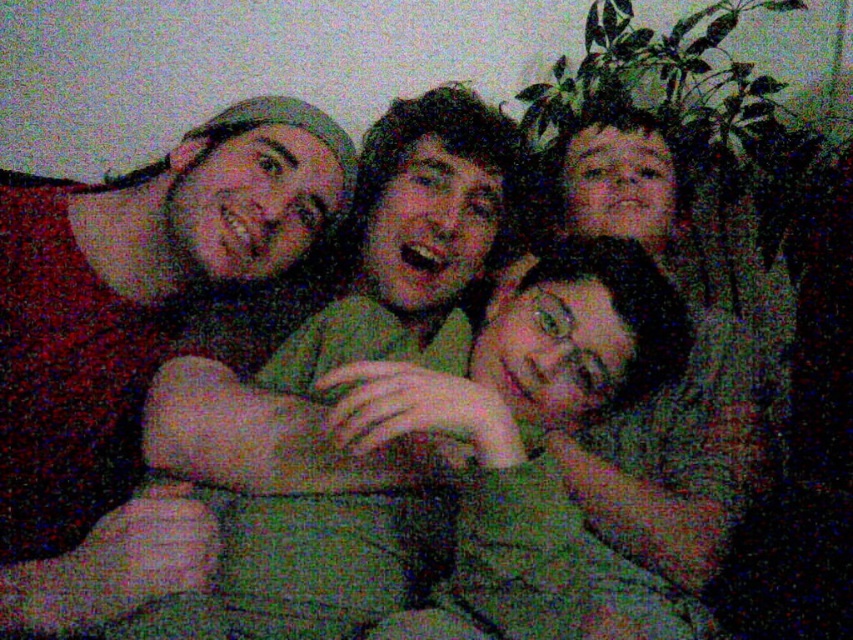
You are trying to place a new decorative item on the couch where the matte red shirt at left and the green fabric pillow at center are located. If you want to place it between these two items, where should you position it?

You should place the new decorative item between the matte red shirt at left and the green fabric pillow at center, as the matte red shirt at left is positioned on the left side of the green fabric pillow at center.

From the picture: You are trying to determine the spatial relationship between the matte red shirt at left and the green fabric pillow at center in the image. Based on the scene description, which object is positioned higher?

The matte red shirt at left is located above the green fabric pillow at center, so it is positioned higher.

You are trying to reach the green fabric pillow at center from where you are standing in front of the matte red shirt at left. Can you easily touch the pillow without moving your body?

The matte red shirt at left is closer to you than the green fabric pillow at center, so you cannot easily touch the pillow without moving your body since it is further away.